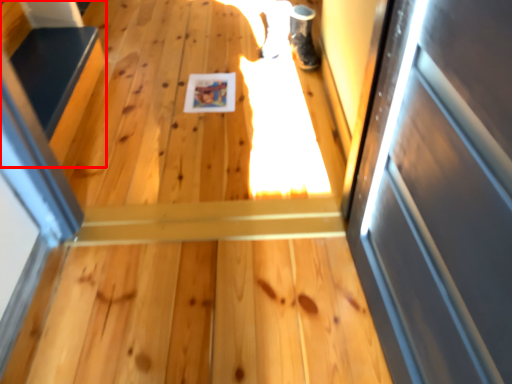
Question: From the image's perspective, where is stairs (annotated by the red box) located in relation to shoe in the image?

Choices:
 (A) below
 (B) above

Answer: (A)